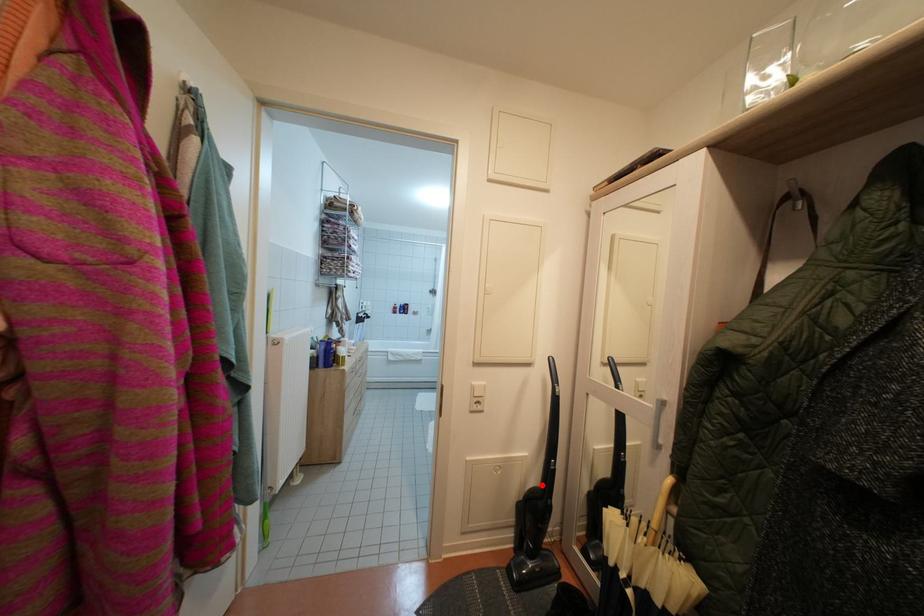
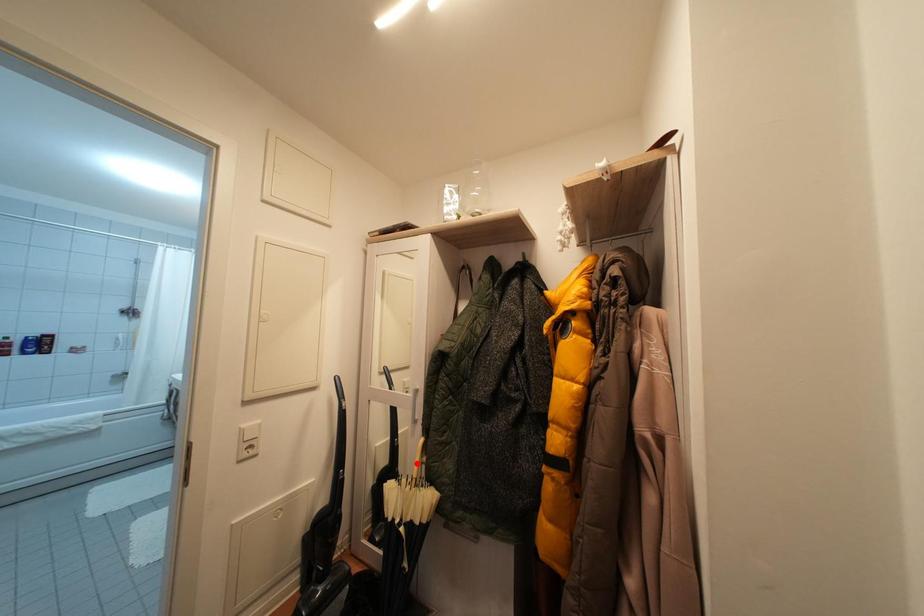
I am providing you with two images of the same scene from different viewpoints. A red point is marked on the first image and another point is marked on the second image. Do the highlighted points in image1 and image2 indicate the same real-world spot?

No